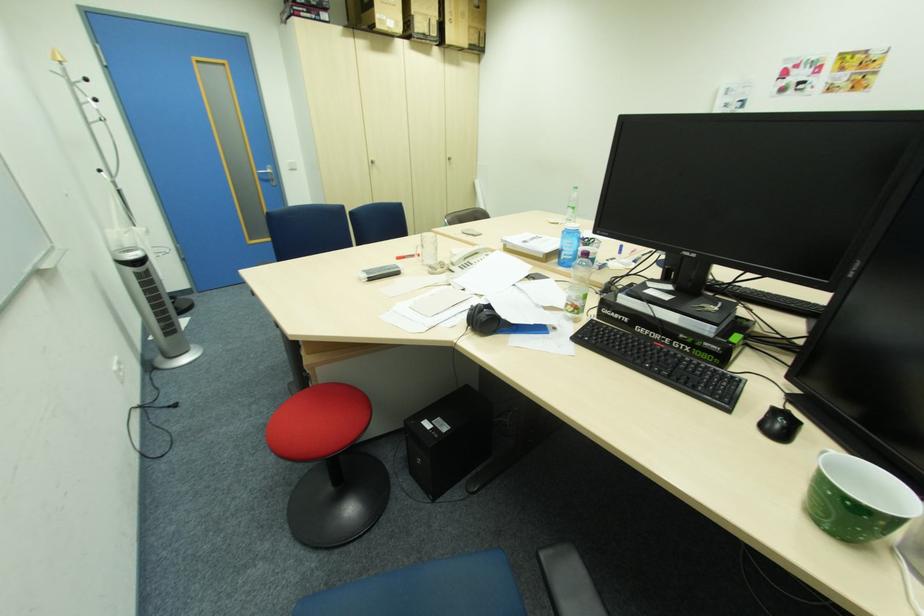
Locate an element on the screen. black chair armrest is located at coordinates (568, 582).